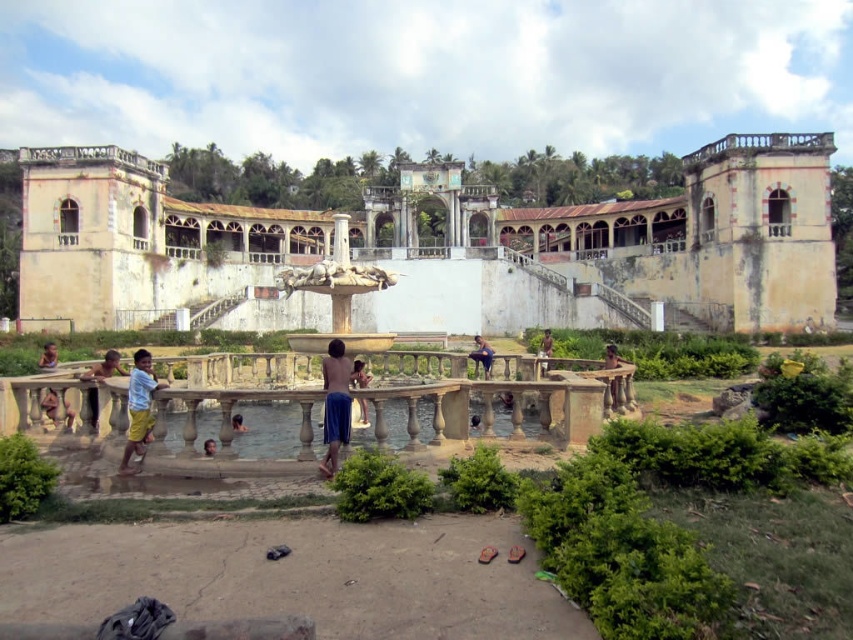
Question: Which object appears closest to the camera in this image?

Choices:
 (A) light blue fabric shorts at lower left
 (B) dark skin human at center

Answer: (A)

Question: Does clear water at center have a greater width compared to blue fabric shirt at center?

Choices:
 (A) no
 (B) yes

Answer: (B)

Question: Can you confirm if white weathered palace at center is smaller than blue fabric shirt at center?

Choices:
 (A) yes
 (B) no

Answer: (B)

Question: Does blue fabric shirt at center have a lesser width compared to dark skin human at center?

Choices:
 (A) no
 (B) yes

Answer: (A)

Question: Which object appears farthest from the camera in this image?

Choices:
 (A) blue fabric shorts at center
 (B) smooth skin child at center

Answer: (B)

Question: Which point appears closest to the camera in this image?

Choices:
 (A) (363, 364)
 (B) (341, 387)
 (C) (547, 340)

Answer: (B)